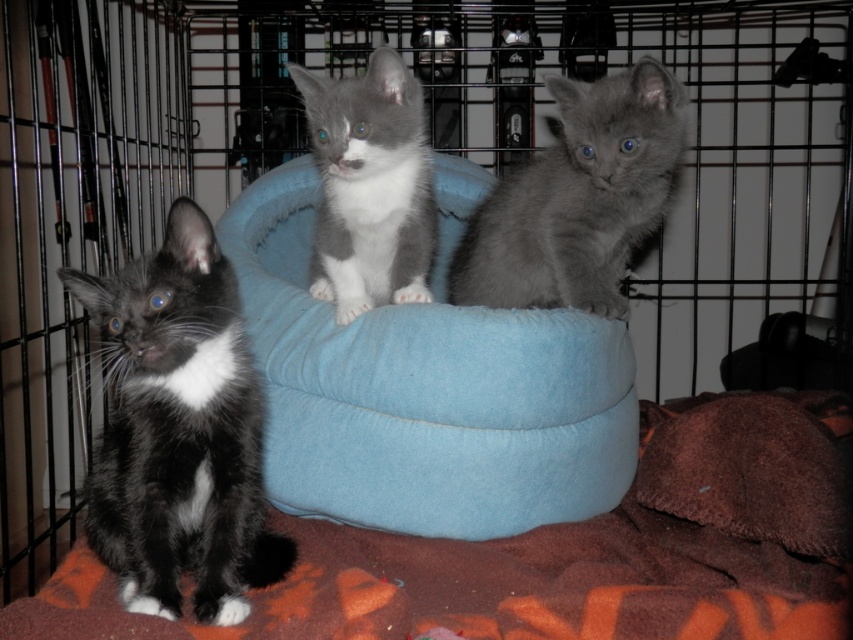
You are a photographer setting up a shot of the kittens in the crate. The blue fabric cat bed at center is where two kittens are sitting. To ensure the bed is centered in your frame, where should you position your camera relative to the point marked at coordinates (424, 394)?

The point marked at coordinates (424, 394) indicates the location of the blue fabric cat bed at center, so you should position your camera directly facing this point to ensure the bed is centered in your frame.

You are standing in front of a pet crate that contains three kittens. You see a gray fluffy kitten at center and a black kitten with white chest. Which kitten is closer to you?

The gray fluffy kitten at center is closer to you, as it is 3.37 feet away from the viewer compared to the other kitten.

You are a cat owner who wants to ensure your black soft fur cat at left has enough space to move around in the crate. Based on the image, does the blue fabric cat bed at center pose a height obstruction for the cat?

The blue fabric cat bed at center is much taller than the black soft fur cat at left, so it might obstruct the cat from moving freely unless it can jump over or go around the bed.